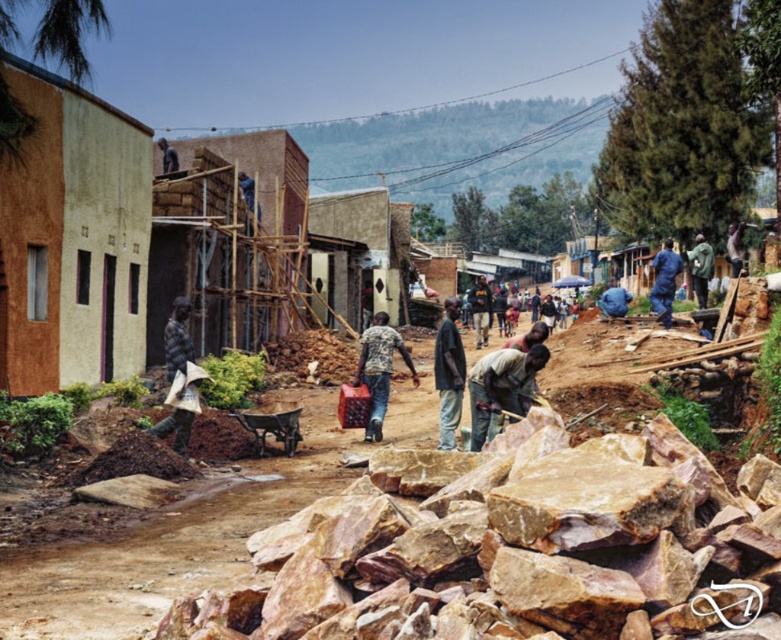
You are a construction worker standing at the point with coordinates point (669, 323). You need to reach a tool located at point (544, 486). Can you walk directly to the tool without going around any obstacles?

Yes, you can walk directly to the tool located at point (544, 486) because it is in front of your current position at point (669, 323), meaning there are no obstacles blocking the path between them.

You are a delivery driver who needs to park your truck, which is 2 meters tall, on the construction site. The truck must be parked in an area where there are no obstacles above it. Based on the scene, can you safely park the truck where the brown rough rocks at center and the dark skin person at center are located?

The brown rough rocks at center is located below the dark skin person at center, so the area where the dark skin person at center is standing has an obstacle above the truck. However, the brown rough rocks at center are below, so parking near them would not have an obstacle above. Therefore, you can safely park the truck near the brown rough rocks at center but avoid the area under the dark skin person at center.